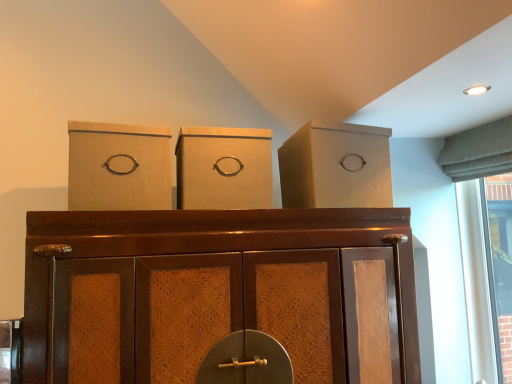
Question: From a real-world perspective, is matte cardboard box at left, the 2th cardboard box in the right-to-left sequence, below matte cardboard box at upper right?

Choices:
 (A) no
 (B) yes

Answer: (B)

Question: Does matte cardboard box at left, the 2th cardboard box in the right-to-left sequence, appear on the right side of matte cardboard box at upper right?

Choices:
 (A) no
 (B) yes

Answer: (A)

Question: Is matte cardboard box at upper right completely or partially inside matte cardboard box at left, the 2th cardboard box in the right-to-left sequence?

Choices:
 (A) no
 (B) yes

Answer: (A)

Question: Is matte cardboard box at left, the 2th cardboard box in the right-to-left sequence, positioned with its back to matte cardboard box at upper right?

Choices:
 (A) yes
 (B) no

Answer: (B)

Question: Is matte cardboard box at left, the first cardboard box from the left, aimed at matte cardboard box at upper right?

Choices:
 (A) no
 (B) yes

Answer: (A)

Question: From a real-world perspective, is matte cardboard box at center, the second cardboard box in the left-to-right sequence, physically located above or below brown wood cupboard at center?

Choices:
 (A) below
 (B) above

Answer: (B)

Question: From their relative heights in the image, would you say matte cardboard box at center, the second cardboard box in the left-to-right sequence, is taller or shorter than brown wood cupboard at center?

Choices:
 (A) short
 (B) tall

Answer: (A)

Question: Based on their positions, is matte cardboard box at center, which appears as the first cardboard box when viewed from the right, located to the left or right of brown wood cupboard at center?

Choices:
 (A) left
 (B) right

Answer: (A)

Question: Is matte cardboard box at center, the second cardboard box in the left-to-right sequence, wider or thinner than brown wood cupboard at center?

Choices:
 (A) wide
 (B) thin

Answer: (B)

Question: Is matte cardboard box at center, the second cardboard box in the left-to-right sequence, wider or thinner than matte cardboard box at left, the 2th cardboard box in the right-to-left sequence?

Choices:
 (A) wide
 (B) thin

Answer: (A)

Question: Considering the positions of matte cardboard box at center, the second cardboard box in the left-to-right sequence, and matte cardboard box at left, the first cardboard box from the left, in the image, is matte cardboard box at center, the second cardboard box in the left-to-right sequence, bigger or smaller than matte cardboard box at left, the first cardboard box from the left,?

Choices:
 (A) big
 (B) small

Answer: (A)

Question: Considering the relative positions of matte cardboard box at center, the second cardboard box in the left-to-right sequence, and matte cardboard box at left, the first cardboard box from the left, in the image provided, is matte cardboard box at center, the second cardboard box in the left-to-right sequence, to the left or to the right of matte cardboard box at left, the first cardboard box from the left,?

Choices:
 (A) left
 (B) right

Answer: (B)

Question: From the image's perspective, is matte cardboard box at center, the second cardboard box in the left-to-right sequence, above or below matte cardboard box at left, the first cardboard box from the left?

Choices:
 (A) below
 (B) above

Answer: (A)

Question: From their relative heights in the image, would you say matte cardboard box at upper right is taller or shorter than matte cardboard box at center, the second cardboard box in the left-to-right sequence?

Choices:
 (A) short
 (B) tall

Answer: (B)

Question: From the image's perspective, is matte cardboard box at upper right positioned above or below matte cardboard box at center, the second cardboard box in the left-to-right sequence?

Choices:
 (A) below
 (B) above

Answer: (B)